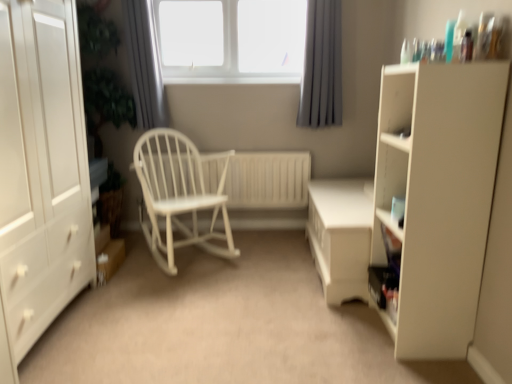
Find the location of a particular element. free space that is to the left of matte white cupboard at right is located at coordinates (336, 330).